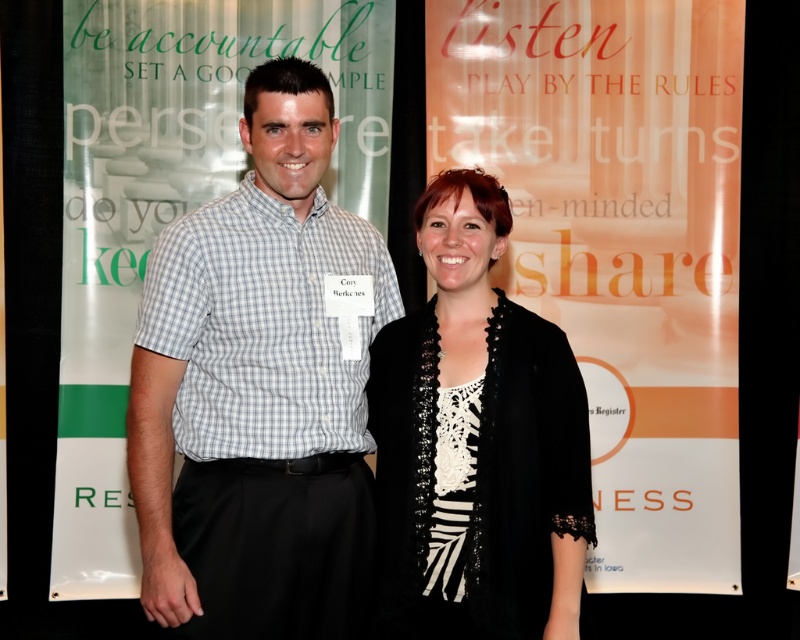
Which is more to the left, checkered fabric shirt at center or black lace top at center?

Positioned to the left is checkered fabric shirt at center.

Who is more distant from viewer, (302,268) or (408,316)?

The point (408,316) is more distant.

The width and height of the screenshot is (800, 640). In order to click on checkered fabric shirt at center in this screenshot , I will do coord(258,392).

The width and height of the screenshot is (800, 640). I want to click on checkered fabric shirt at center, so click(258, 392).